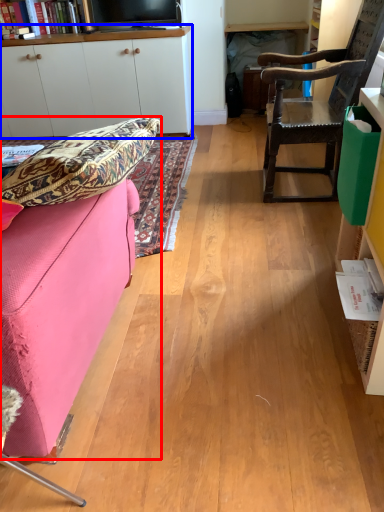
Question: Which point is closer to the camera, studio couch (highlighted by a red box) or cabinetry (highlighted by a blue box)?

Choices:
 (A) studio couch
 (B) cabinetry

Answer: (A)